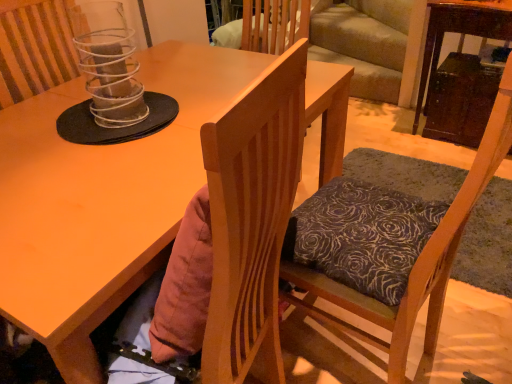
The width and height of the screenshot is (512, 384). I want to click on free spot above matte wood desk at center (from a real-world perspective), so click(114, 136).